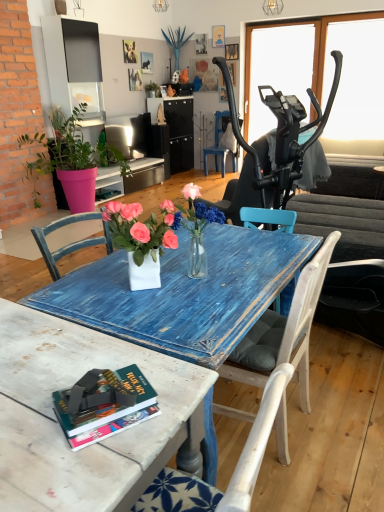
The image size is (384, 512). Identify the location of unoccupied area in front of hardcover book at lower left. (83, 467).